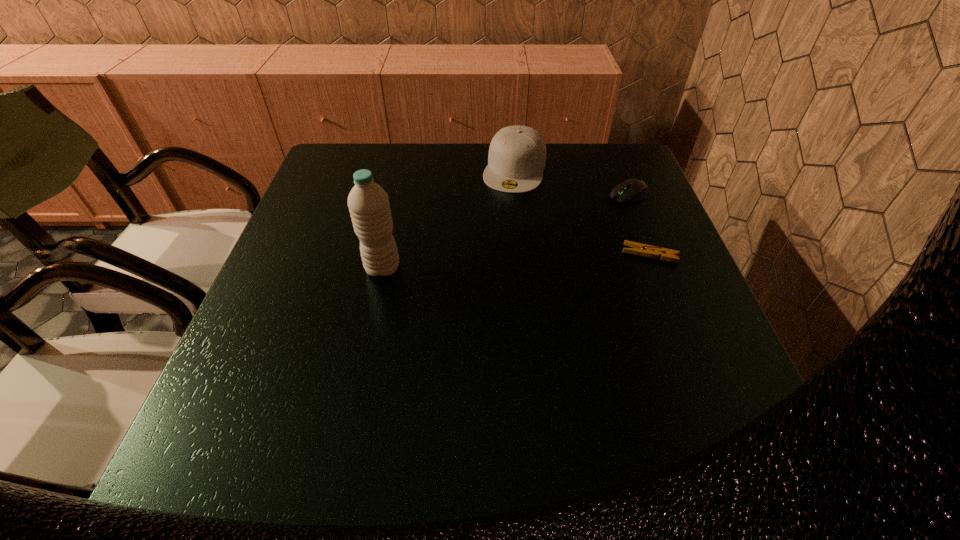
Where is `vacant space located 0.070m on the front-facing side of the second object from left to right`? Image resolution: width=960 pixels, height=540 pixels. vacant space located 0.070m on the front-facing side of the second object from left to right is located at coordinates (505, 208).

Find the location of a particular element. The width and height of the screenshot is (960, 540). free space located on the wheel side of the computer mouse is located at coordinates tap(557, 228).

Locate an element on the screen. blank space located on the wheel side of the computer mouse is located at coordinates (581, 217).

This screenshot has height=540, width=960. Find the location of `vacant space located on the wheel side of the computer mouse`. vacant space located on the wheel side of the computer mouse is located at coordinates (531, 240).

You are a GUI agent. You are given a task and a screenshot of the screen. Output one action in this format:
    pyautogui.click(x=<x>, y=<y>)
    Task: Click on the cap located in the far edge section of the desktop
    The image size is (960, 540).
    Given the screenshot: What is the action you would take?
    pyautogui.click(x=517, y=154)

The width and height of the screenshot is (960, 540). I want to click on computer mouse at the far edge, so click(631, 190).

The width and height of the screenshot is (960, 540). Find the location of `clothespin that is at the right edge`. clothespin that is at the right edge is located at coordinates (639, 249).

The height and width of the screenshot is (540, 960). Find the location of `computer mouse that is at the right edge`. computer mouse that is at the right edge is located at coordinates (631, 190).

At what (x,y) coordinates should I click in order to perform the action: click on object present at the far right corner. Please return your answer as a coordinate pair (x, y). Image resolution: width=960 pixels, height=540 pixels. Looking at the image, I should click on (631, 190).

The image size is (960, 540). Find the location of `vacant position at the far edge of the desktop`. vacant position at the far edge of the desktop is located at coordinates (484, 185).